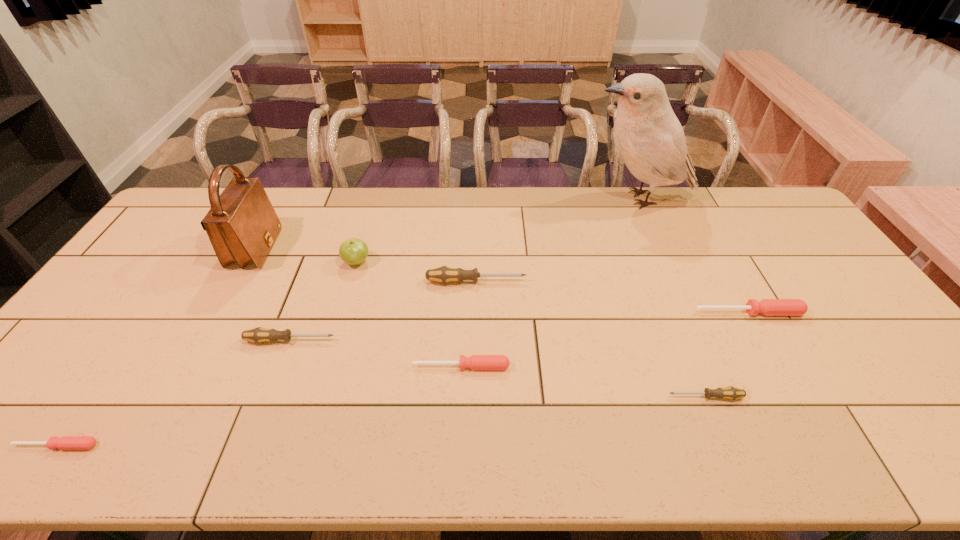
Where is `blank area in the image that satisfies the following two spatial constraints: 1. on the face of the tallest object; 2. on the front side of the green apple`? This screenshot has height=540, width=960. blank area in the image that satisfies the following two spatial constraints: 1. on the face of the tallest object; 2. on the front side of the green apple is located at coordinates (666, 262).

Locate an element on the screen. Image resolution: width=960 pixels, height=540 pixels. vacant space that satisfies the following two spatial constraints: 1. on the front flap of the second object from left to right; 2. on the left side of the biggest red screwdriver is located at coordinates click(x=221, y=312).

Identify the location of vacant position in the image that satisfies the following two spatial constraints: 1. on the front flap of the second object from left to right; 2. on the back side of the apple. Image resolution: width=960 pixels, height=540 pixels. (249, 262).